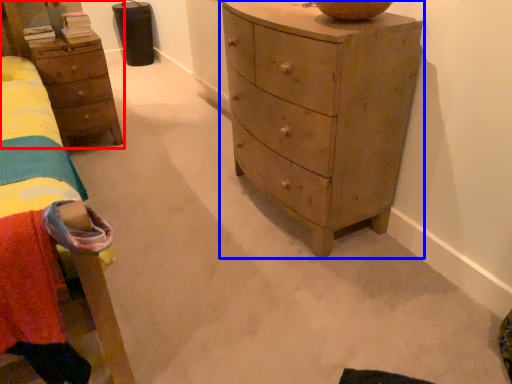
Question: Which object is closer to the camera taking this photo, nightstand (highlighted by a red box) or chest of drawers (highlighted by a blue box)?

Choices:
 (A) nightstand
 (B) chest of drawers

Answer: (B)